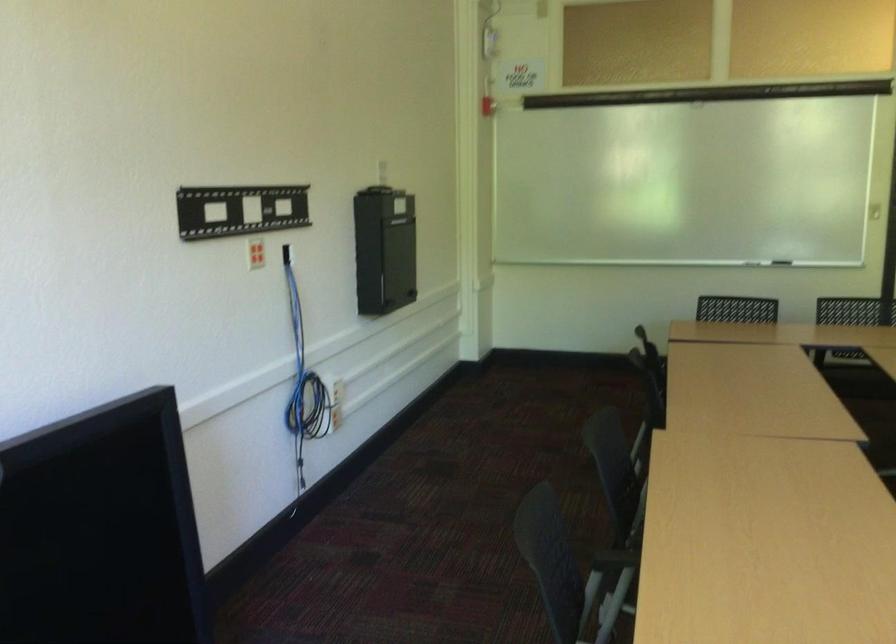
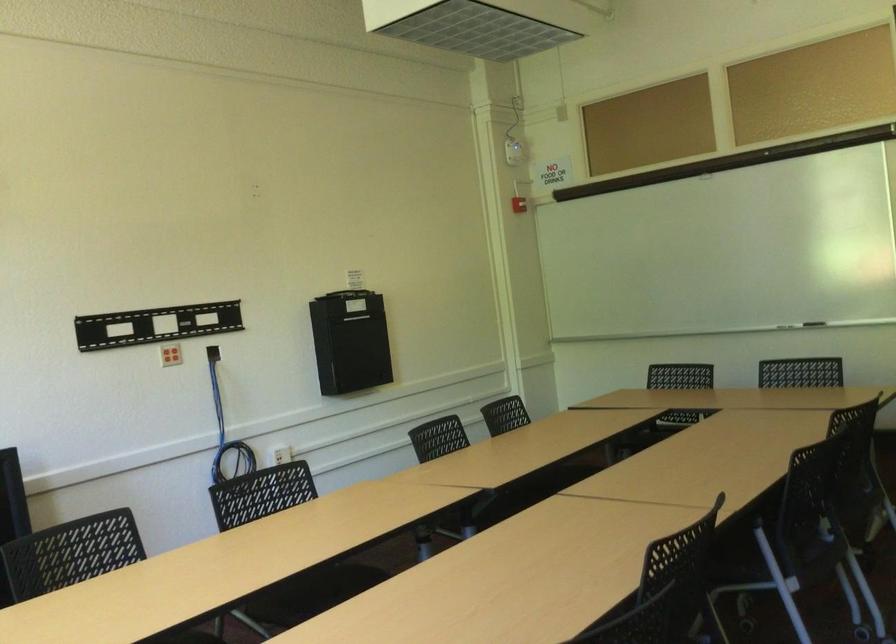
The point at (478, 102) is marked in the first image. Where is the corresponding point in the second image?

(519, 204)